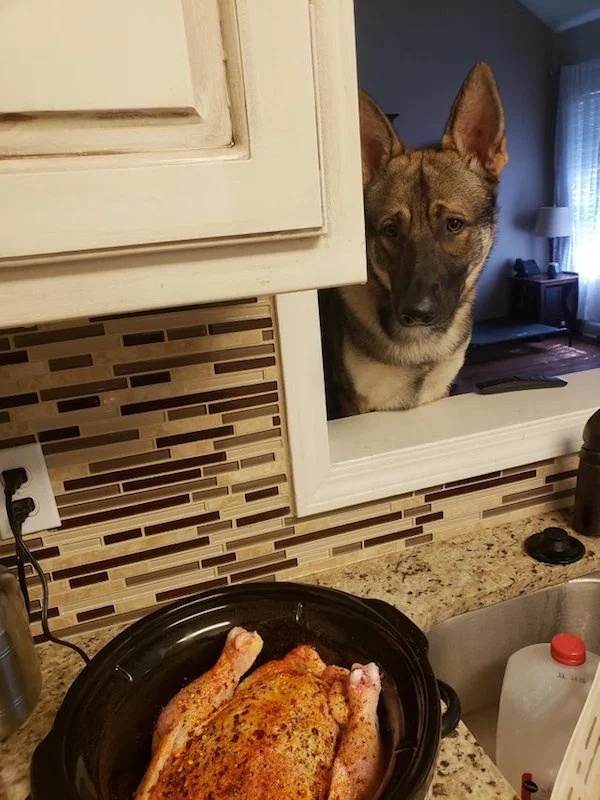
What are the coordinates of `tile backsplash` in the screenshot? It's located at (156, 509).